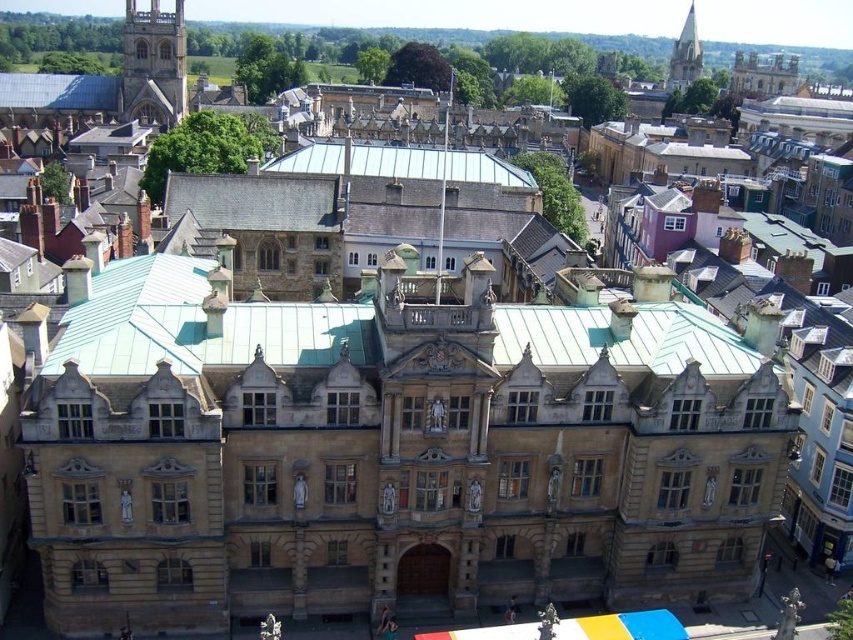
Who is positioned more to the left, green tile roof at center or stone tower at upper left?

stone tower at upper left

Which is above, green tile roof at center or stone tower at upper left?

Positioned higher is stone tower at upper left.

Who is more forward, (x=339, y=164) or (x=134, y=36)?

Point (x=339, y=164)

You are a GUI agent. You are given a task and a screenshot of the screen. Output one action in this format:
    pyautogui.click(x=<x>, y=<y>)
    Task: Click on the green tile roof at center
    The width and height of the screenshot is (853, 640).
    Given the screenshot: What is the action you would take?
    pyautogui.click(x=361, y=161)

Where is `stone tower at upper left`? stone tower at upper left is located at coordinates (154, 65).

Which of these two, stone tower at upper left or smooth stone spire at upper right, stands taller?

Standing taller between the two is smooth stone spire at upper right.

Find the location of a particular element. Image resolution: width=853 pixels, height=640 pixels. stone tower at upper left is located at coordinates (154, 65).

What are the coordinates of `stone tower at upper left` in the screenshot? It's located at (154, 65).

Which is below, green tile roof at center or smooth stone spire at upper right?

green tile roof at center is lower down.

Is point (432, 179) farther from camera compared to point (693, 17)?

No, it is in front of (693, 17).

Image resolution: width=853 pixels, height=640 pixels. I want to click on green tile roof at center, so click(x=361, y=161).